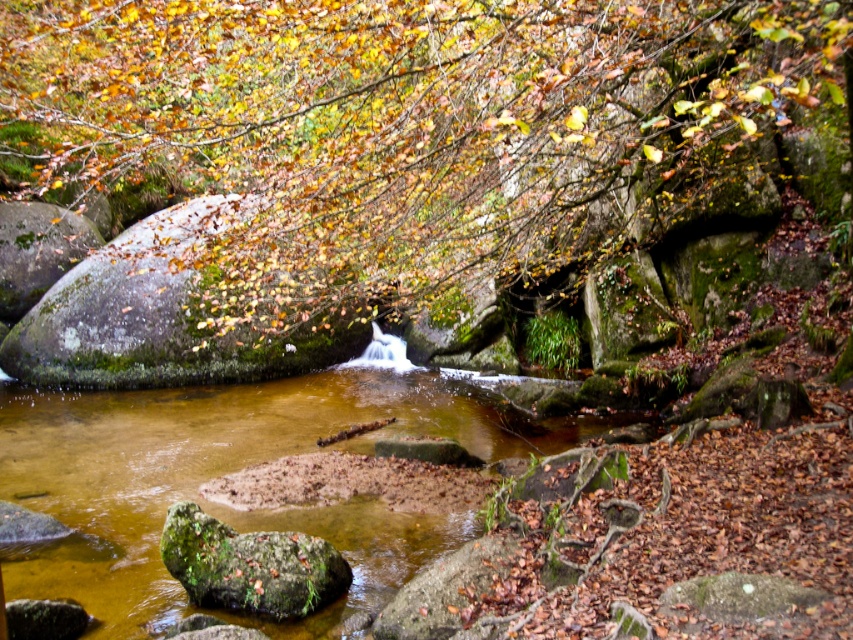
Question: Among these points, which one is nearest to the camera?

Choices:
 (A) (251, 566)
 (B) (376, 557)

Answer: (A)

Question: Which point is farther from the camera taking this photo?

Choices:
 (A) (73, 433)
 (B) (434, 163)

Answer: (A)

Question: Does brown/muddy stream at center come behind green mossy rock at lower left?

Choices:
 (A) no
 (B) yes

Answer: (A)

Question: Which of the following is the farthest from the observer?

Choices:
 (A) brown/muddy stream at center
 (B) green mossy rock at center
 (C) green mossy rock at lower left

Answer: (C)

Question: In this image, where is green mossy rock at center located relative to green mossy rock at lower left?

Choices:
 (A) below
 (B) above

Answer: (B)

Question: Can you confirm if green mossy rock at center is wider than green mossy rock at upper left?

Choices:
 (A) no
 (B) yes

Answer: (B)